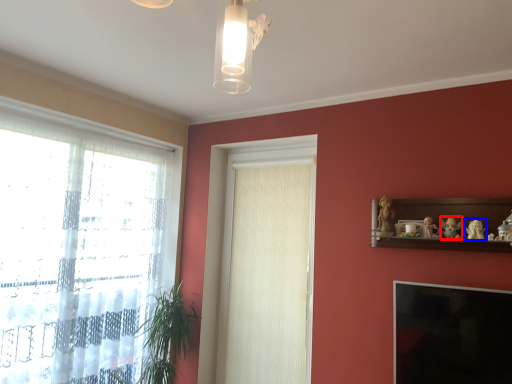
Question: Which point is further to the camera, toy (highlighted by a red box) or toy (highlighted by a blue box)?

Choices:
 (A) toy
 (B) toy

Answer: (A)